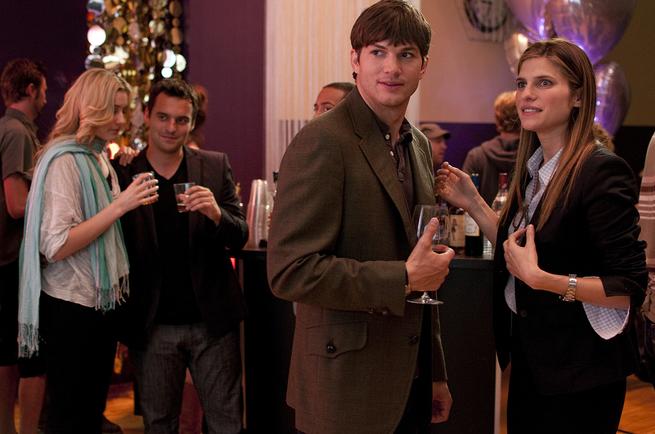
Where is `glass`? This screenshot has height=434, width=655. glass is located at coordinates (440, 219).